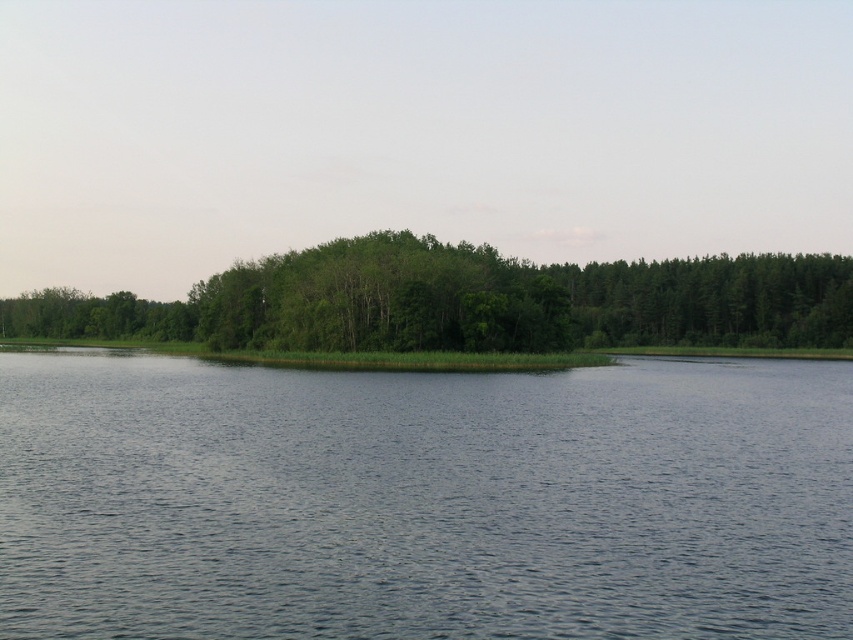
You are standing at the edge of the water in the serene natural landscape. You notice two points marked in the image. The first point is at coordinates point (454, 378) and the second is at point (767, 284). If you were to walk towards both points, which point would you reach first?

Point (454, 378) is in front of point (767, 284), so you would reach point (454, 378) first.

You are an environmental scientist assessing the ecological balance of the landscape. You observe the blue water at center and the green leafy trees at center. Which object occupies a larger area in the scene?

The green leafy trees at center occupy a larger area in the scene compared to the blue water at center, as the blue water at center has a smaller size compared to green leafy trees at center.

You are standing at the edge of the landscape and want to locate the blue water at center. According to the coordinates provided, in which direction should you look to find it?

The blue water at center is located at coordinates point (422, 499), so you should look towards the lower center direction to find it.